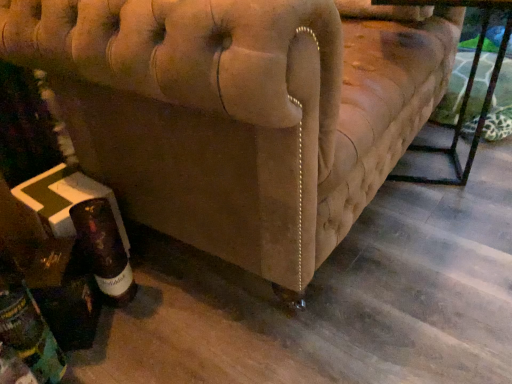
Locate an element on the screen. vacant area located to the right-hand side of brown glass bottle at lower left, which appears as the second bottle when viewed from the left is located at coordinates (180, 292).